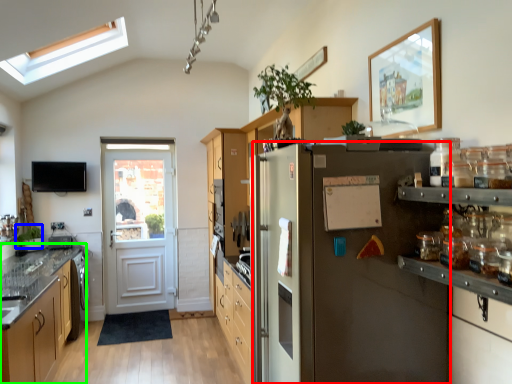
Question: Estimate the real-world distances between objects in this image. Which object is closer to refrigerator (highlighted by a red box), plant (highlighted by a blue box) or cabinetry (highlighted by a green box)?

Choices:
 (A) plant
 (B) cabinetry

Answer: (B)